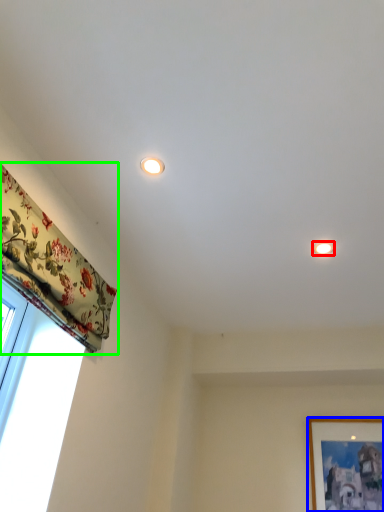
Question: Estimate the real-world distances between objects in this image. Which object is closer to lighting (highlighted by a red box), picture frame (highlighted by a blue box) or curtain (highlighted by a green box)?

Choices:
 (A) picture frame
 (B) curtain

Answer: (B)